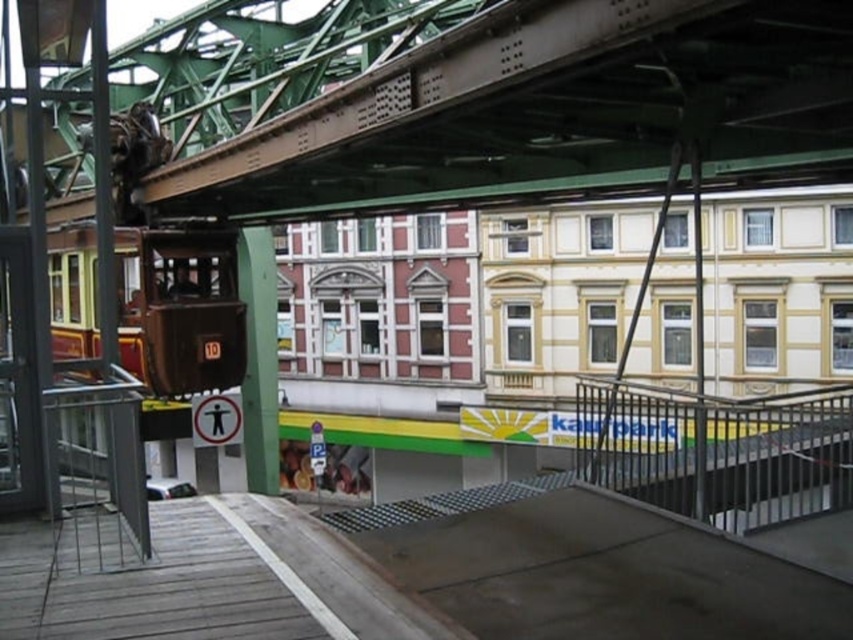
You are a maintenance worker needing to reach the top of the green metallic bridge at upper center and the black metal railing at lower right. Which structure will require you to climb higher?

The black metal railing at lower right requires climbing higher because it has a greater height than the green metallic bridge at upper center.

You are a photographer standing at the edge of the wooden platform. You want to take a photo that includes both the green metallic bridge at upper center and the black metal railing at lower right. Which object will appear larger in your photo?

The green metallic bridge at upper center will appear larger in the photo because it is closer to the viewer than the black metal railing at lower right.